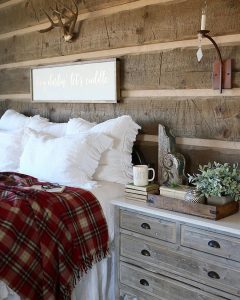
Image resolution: width=240 pixels, height=300 pixels. Find the location of `cup coffee`. cup coffee is located at coordinates (143, 172).